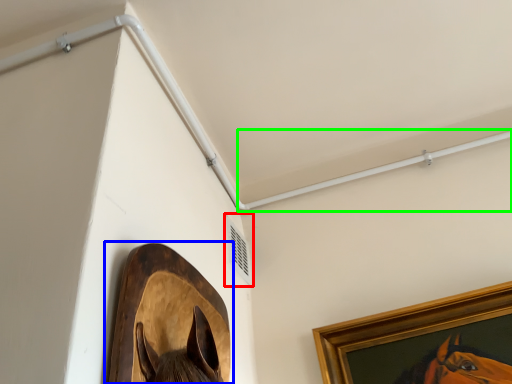
Question: Which object is positioned closest to air conditioning (highlighted by a red box)? Select from picture frame (highlighted by a blue box) and beam (highlighted by a green box).

Choices:
 (A) picture frame
 (B) beam

Answer: (B)